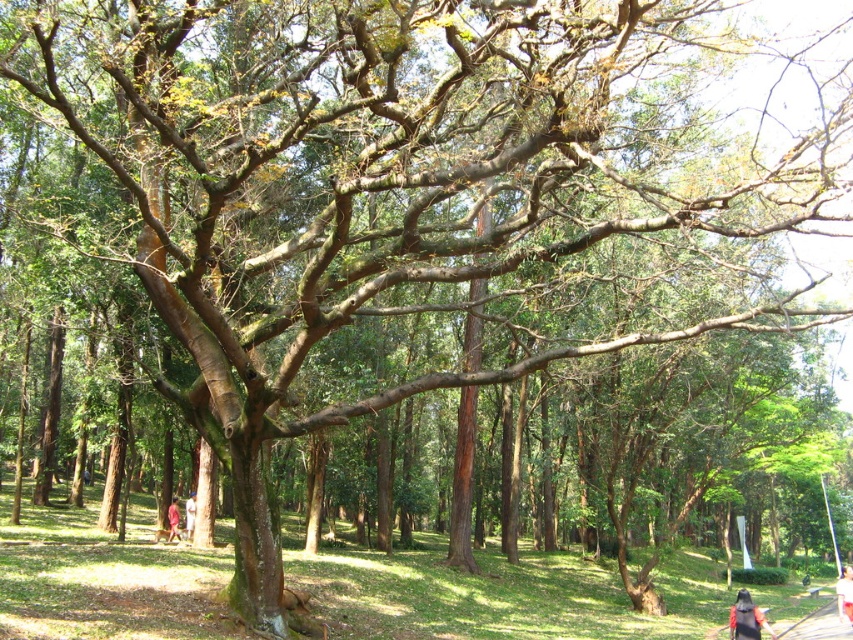
Question: Is white cotton shirt at center bigger than light brown fabric jacket at lower center?

Choices:
 (A) no
 (B) yes

Answer: (B)

Question: Estimate the real-world distances between objects in this image. Which object is closer to the light brown fabric jacket at lower center?

Choices:
 (A) white cotton shirt at center
 (B) dark blue shirt at lower right
 (C) red fabric person at lower left

Answer: (C)

Question: Which point appears farthest from the camera in this image?

Choices:
 (A) (177, 525)
 (B) (189, 532)
 (C) (844, 582)
 (D) (735, 611)

Answer: (A)

Question: Is dark blue shirt at lower right closer to camera compared to light brown fabric jacket at lower center?

Choices:
 (A) no
 (B) yes

Answer: (B)

Question: Which of the following is the closest to the observer?

Choices:
 (A) dark blue shirt at lower right
 (B) light brown fabric jacket at lower center
 (C) red fabric person at lower left
 (D) white cotton shirt at center

Answer: (A)

Question: Is white cotton shirt at center thinner than red fabric person at lower left?

Choices:
 (A) yes
 (B) no

Answer: (B)